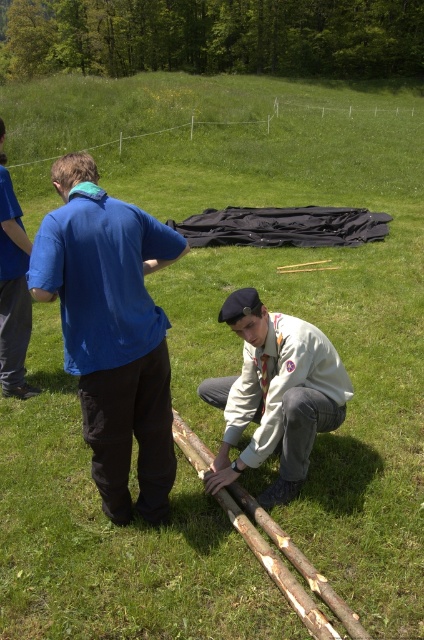
Is the position of blue cotton shirt at center more distant than that of white matte uniform at center?

No, blue cotton shirt at center is closer to the viewer.

Who is positioned more to the left, blue cotton shirt at center or white matte uniform at center?

blue cotton shirt at center is more to the left.

Which is in front, point (167, 445) or point (287, 390)?

Point (167, 445) is more forward.

I want to click on blue cotton shirt at center, so click(111, 332).

Is blue cotton shirt at center shorter than blue cotton shirt at left?

Yes.

Does blue cotton shirt at center appear on the left side of blue cotton shirt at left?

Incorrect, blue cotton shirt at center is not on the left side of blue cotton shirt at left.

Between point (133, 403) and point (19, 321), which one is positioned behind?

The point (19, 321) is behind.

Identify the location of blue cotton shirt at center. This screenshot has width=424, height=640. (111, 332).

Which is behind, point (276, 324) or point (19, 237)?

The point (19, 237) is more distant.

Between white matte uniform at center and blue cotton shirt at left, which one is positioned higher?

blue cotton shirt at left is higher up.

What do you see at coordinates (275, 394) in the screenshot? I see `white matte uniform at center` at bounding box center [275, 394].

Find the location of a particular element. This screenshot has height=640, width=424. white matte uniform at center is located at coordinates (275, 394).